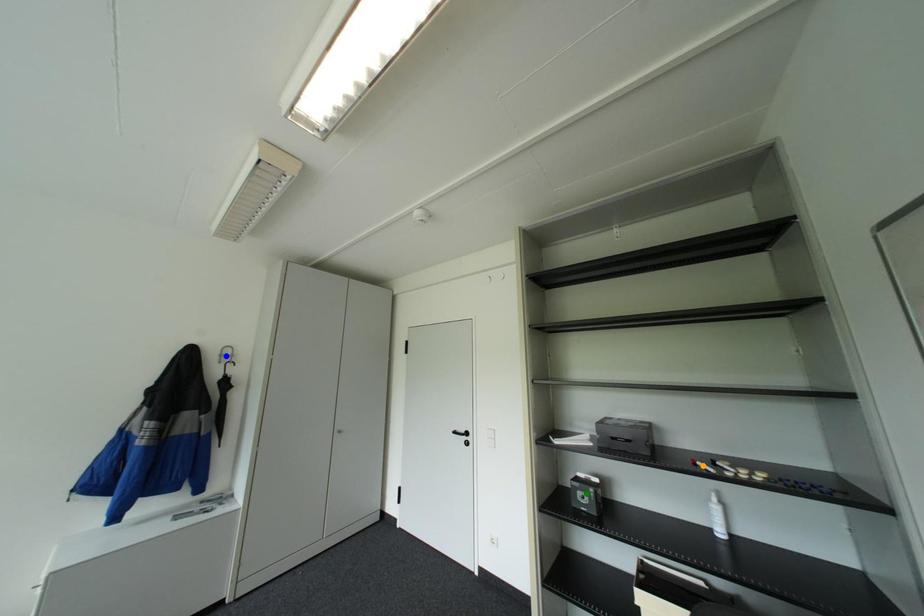
Order these from farthest to nearest:
A) blue point
B) orange point
C) green point

blue point < green point < orange point